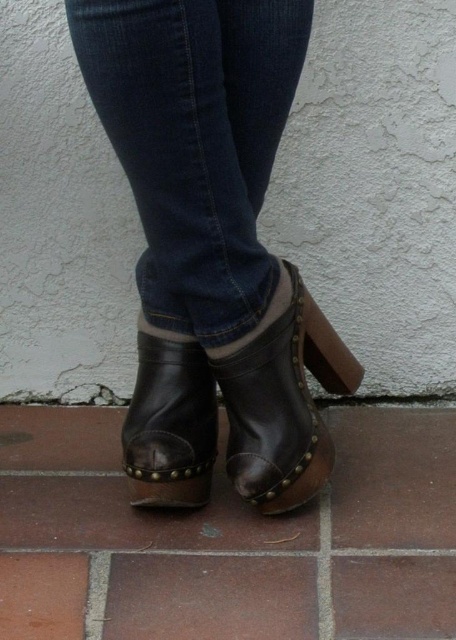
Question: Which is nearer to the leather boot at center?

Choices:
 (A) dark blue denim jeans at center
 (B) leather boot at lower center

Answer: (B)

Question: Does dark blue denim jeans at center appear under leather boot at center?

Choices:
 (A) no
 (B) yes

Answer: (A)

Question: Can you confirm if dark blue denim jeans at center is thinner than leather boot at center?

Choices:
 (A) no
 (B) yes

Answer: (A)

Question: Which object is positioned closest to the dark blue denim jeans at center?

Choices:
 (A) leather boot at lower center
 (B) leather boot at center

Answer: (B)

Question: Is leather boot at center above leather boot at lower center?

Choices:
 (A) yes
 (B) no

Answer: (A)

Question: Which of the following is the closest to the observer?

Choices:
 (A) dark blue denim jeans at center
 (B) leather boot at lower center

Answer: (A)